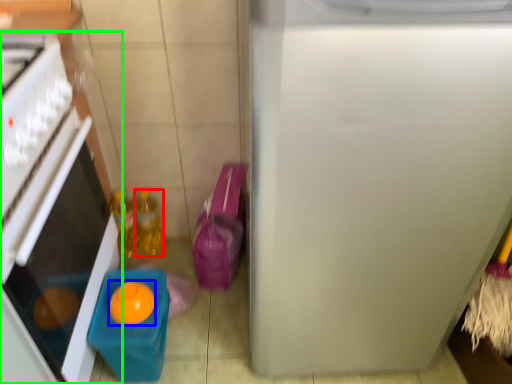
Question: Based on their relative distances, which object is nearer to bottle (highlighted by a red box)? Choose from orange (highlighted by a blue box) and home appliance (highlighted by a green box).

Choices:
 (A) orange
 (B) home appliance

Answer: (A)